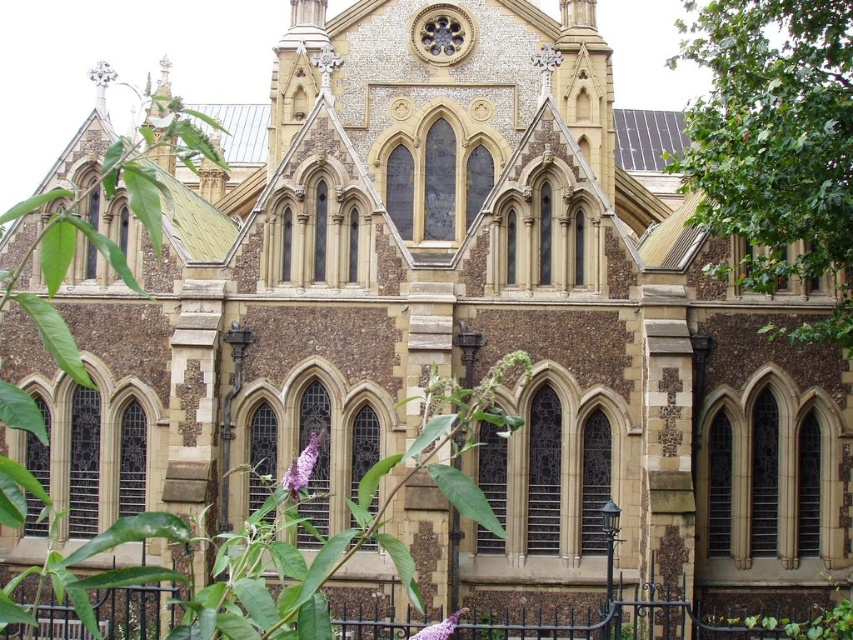
Is purple matte flower at center to the left of purple matte flower at lower center from the viewer's perspective?

Yes, purple matte flower at center is to the left of purple matte flower at lower center.

Does purple matte flower at center have a greater height compared to purple matte flower at lower center?

In fact, purple matte flower at center may be shorter than purple matte flower at lower center.

The image size is (853, 640). In order to click on purple matte flower at center in this screenshot , I will do `click(302, 467)`.

Is green leafy tree at right bigger than purple matte flower at lower center?

Yes.

Where is `green leafy tree at right`? green leafy tree at right is located at coordinates (775, 145).

Who is more distant from viewer, (813,264) or (437,634)?

The point (813,264) is behind.

Locate an element on the screen. Image resolution: width=853 pixels, height=640 pixels. green leafy tree at right is located at coordinates (775, 145).

Is green leafy tree at right to the right of purple matte flower at center from the viewer's perspective?

Correct, you'll find green leafy tree at right to the right of purple matte flower at center.

Is green leafy tree at right below purple matte flower at center?

No, green leafy tree at right is not below purple matte flower at center.

The width and height of the screenshot is (853, 640). Find the location of `green leafy tree at right`. green leafy tree at right is located at coordinates (775, 145).

You are a GUI agent. You are given a task and a screenshot of the screen. Output one action in this format:
    pyautogui.click(x=<x>, y=<y>)
    Task: Click on the green leafy tree at right
    The height and width of the screenshot is (640, 853).
    Given the screenshot: What is the action you would take?
    pyautogui.click(x=775, y=145)